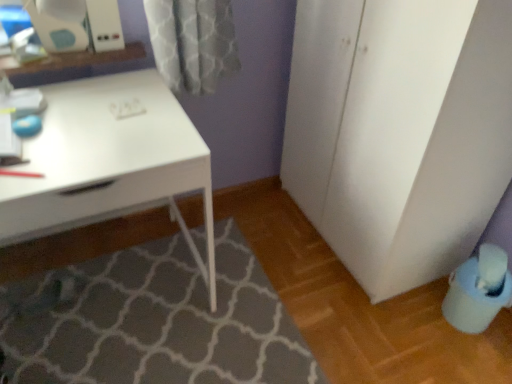
Describe the element at coordinates (109, 161) in the screenshot. I see `white glossy desk at upper left` at that location.

I want to click on gray textured bath mat at lower center, so click(153, 321).

Which object is thinner, white glossy desk at upper left or white matte cabinet at right?

white matte cabinet at right is thinner.

Which of these two, white glossy desk at upper left or white matte cabinet at right, is smaller?

white glossy desk at upper left.

Is white glossy desk at upper left aimed at white matte cabinet at right?

No, white glossy desk at upper left does not turn towards white matte cabinet at right.

Can you tell me how much white glossy desk at upper left and white matte cabinet at right differ in facing direction?

The facing directions of white glossy desk at upper left and white matte cabinet at right are 91.1 degrees apart.

Is point (411, 241) positioned before point (54, 91)?

No.

From the image's perspective, is white matte cabinet at right beneath white glossy desk at upper left?

Actually, white matte cabinet at right appears above white glossy desk at upper left in the image.

From a real-world perspective, is white matte cabinet at right located higher than white glossy desk at upper left?

Indeed, from a real-world perspective, white matte cabinet at right stands above white glossy desk at upper left.

Does gray textured bath mat at lower center have a greater height compared to blue plastic swivel chair at lower right?

Incorrect, the height of gray textured bath mat at lower center is not larger of that of blue plastic swivel chair at lower right.

The width and height of the screenshot is (512, 384). I want to click on bath mat in front of the blue plastic swivel chair at lower right, so click(x=153, y=321).

Is gray textured bath mat at lower center surrounding blue plastic swivel chair at lower right?

Actually, blue plastic swivel chair at lower right is outside gray textured bath mat at lower center.

Can you tell me how much blue plastic swivel chair at lower right and white matte cabinet at right differ in facing direction?

There is a 1.34-degree angle between the facing directions of blue plastic swivel chair at lower right and white matte cabinet at right.

Which is more to the right, blue plastic swivel chair at lower right or white matte cabinet at right?

blue plastic swivel chair at lower right.

Is blue plastic swivel chair at lower right in front of white matte cabinet at right?

No, the depth of blue plastic swivel chair at lower right is greater than that of white matte cabinet at right.

Is blue plastic swivel chair at lower right placed right next to white matte cabinet at right?

No.

Which is behind, white glossy desk at upper left or gray textured bath mat at lower center?

gray textured bath mat at lower center is behind.

Is white glossy desk at upper left bigger than gray textured bath mat at lower center?

Correct, white glossy desk at upper left is larger in size than gray textured bath mat at lower center.

What's the angular difference between white glossy desk at upper left and gray textured bath mat at lower center's facing directions?

179 degrees.

From a real-world perspective, which object rests below the other?

gray textured bath mat at lower center, from a real-world perspective.

Is white matte cabinet at right facing away from blue plastic swivel chair at lower right?

white matte cabinet at right does not have its back to blue plastic swivel chair at lower right.

Consider the image. Are white matte cabinet at right and blue plastic swivel chair at lower right located far from each other?

No, white matte cabinet at right is in close proximity to blue plastic swivel chair at lower right.

What's the angular difference between white matte cabinet at right and blue plastic swivel chair at lower right's facing directions?

The facing directions of white matte cabinet at right and blue plastic swivel chair at lower right are 1.34 degrees apart.

Considering the relative sizes of white matte cabinet at right and blue plastic swivel chair at lower right in the image provided, is white matte cabinet at right taller than blue plastic swivel chair at lower right?

Yes, white matte cabinet at right is taller than blue plastic swivel chair at lower right.

Is gray textured bath mat at lower center turned away from white matte cabinet at right?

gray textured bath mat at lower center is not turned away from white matte cabinet at right.

Consider the image. Does gray textured bath mat at lower center come in front of white matte cabinet at right?

No, the depth of gray textured bath mat at lower center is greater than that of white matte cabinet at right.

Considering the relative positions of gray textured bath mat at lower center and white matte cabinet at right in the image provided, is gray textured bath mat at lower center to the left or to the right of white matte cabinet at right?

Based on their positions, gray textured bath mat at lower center is located to the left of white matte cabinet at right.

Is gray textured bath mat at lower center far away from white matte cabinet at right?

gray textured bath mat at lower center is near white matte cabinet at right, not far away.

Image resolution: width=512 pixels, height=384 pixels. Identify the location of desk that appears on the left of white matte cabinet at right. (109, 161).

This screenshot has height=384, width=512. Find the location of `desk below the white matte cabinet at right (from a real-world perspective)`. desk below the white matte cabinet at right (from a real-world perspective) is located at coordinates (109, 161).

Consider the image. When comparing their distances from gray textured bath mat at lower center, does white glossy desk at upper left or white matte cabinet at right seem further?

white matte cabinet at right.

Looking at the image, which one is located closer to gray textured bath mat at lower center, white glossy desk at upper left or blue plastic swivel chair at lower right?

white glossy desk at upper left.

Looking at the image, which one is located further to gray textured bath mat at lower center, blue plastic swivel chair at lower right or white matte cabinet at right?

The object further to gray textured bath mat at lower center is blue plastic swivel chair at lower right.

Based on their spatial positions, is white matte cabinet at right or blue plastic swivel chair at lower right closer to white glossy desk at upper left?

Among the two, white matte cabinet at right is located nearer to white glossy desk at upper left.

When comparing their distances from gray textured bath mat at lower center, does white matte cabinet at right or blue plastic swivel chair at lower right seem closer?

white matte cabinet at right is closer to gray textured bath mat at lower center.

Considering their positions, is gray textured bath mat at lower center positioned closer to white matte cabinet at right than white glossy desk at upper left?

The object closer to white matte cabinet at right is white glossy desk at upper left.

When comparing their distances from blue plastic swivel chair at lower right, does gray textured bath mat at lower center or white glossy desk at upper left seem closer?

The object closer to blue plastic swivel chair at lower right is gray textured bath mat at lower center.

Considering their positions, is white matte cabinet at right positioned further to gray textured bath mat at lower center than white glossy desk at upper left?

Based on the image, white matte cabinet at right appears to be further to gray textured bath mat at lower center.

Identify the location of file cabinet between gray textured bath mat at lower center and blue plastic swivel chair at lower right. Image resolution: width=512 pixels, height=384 pixels. (399, 131).

Find the location of a particular element. The image size is (512, 384). bath mat between white glossy desk at upper left and blue plastic swivel chair at lower right is located at coordinates (153, 321).

Identify the location of bath mat between white glossy desk at upper left and white matte cabinet at right. The image size is (512, 384). (153, 321).

Locate an element on the screen. file cabinet situated between white glossy desk at upper left and blue plastic swivel chair at lower right from left to right is located at coordinates (399, 131).